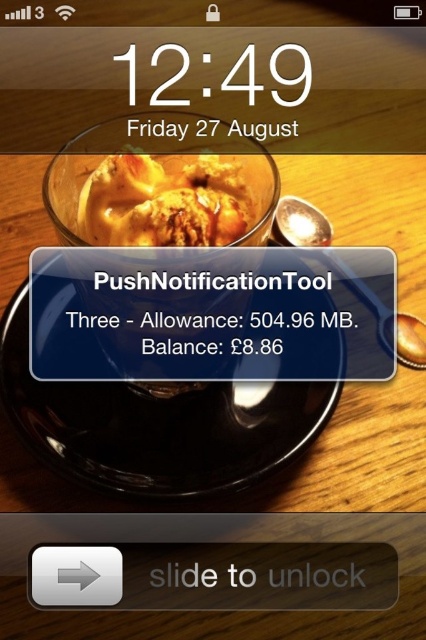
Is black glossy plate at center bigger than golden brown crumbly pastry at upper center?

Indeed, black glossy plate at center has a larger size compared to golden brown crumbly pastry at upper center.

Does black glossy plate at center have a lesser height compared to golden brown crumbly pastry at upper center?

Incorrect, black glossy plate at center's height does not fall short of golden brown crumbly pastry at upper center's.

Which is behind, point (284, 435) or point (236, 189)?

The point (236, 189) is behind.

Identify the location of black glossy plate at center. Image resolution: width=426 pixels, height=640 pixels. (155, 422).